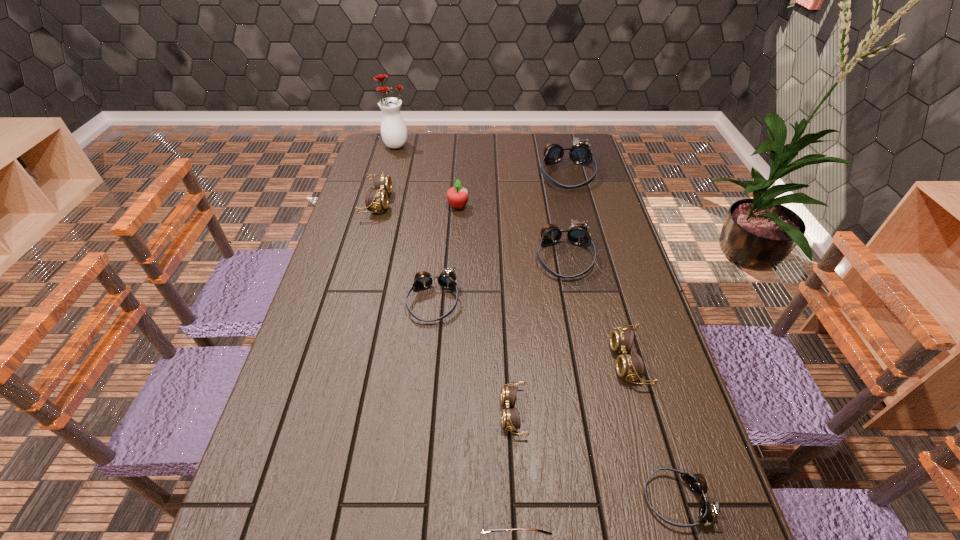
This screenshot has width=960, height=540. I want to click on the second brown goggles from right to left, so click(510, 419).

Identify the location of the smallest brown goggles. (510, 419).

Find the location of `the smallest bronze goggles`. the smallest bronze goggles is located at coordinates (708, 511).

Where is `the nearest bronze goggles`? the nearest bronze goggles is located at coordinates (708, 511).

What are the coordinates of `free region located 0.120m on the front of the tallest object` in the screenshot? It's located at (390, 168).

Find the location of a particular element. vacant space situated 0.130m on the left of the apple is located at coordinates (410, 207).

Identify the location of vacant point located 0.390m through the lenses of the biggest bronze goggles. This screenshot has width=960, height=540. (590, 267).

Find the location of a particular element. Image resolution: width=960 pixels, height=540 pixels. vacant space located through the lenses of the leftmost goggles is located at coordinates (431, 202).

In order to click on vacant space situated 0.230m through the lenses of the second biggest bronze goggles in this screenshot , I will do `click(582, 347)`.

Image resolution: width=960 pixels, height=540 pixels. I want to click on vacant space located 0.280m through the lenses of the second smallest brown goggles, so click(498, 361).